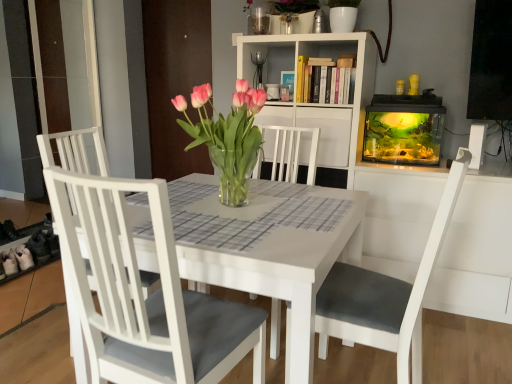
Question: Is pink glass vase at center thinner than white matte chair at left, placed as the 1th chair when sorted from left to right?

Choices:
 (A) no
 (B) yes

Answer: (B)

Question: Does pink glass vase at center lie behind white matte chair at left, placed as the 1th chair when sorted from left to right?

Choices:
 (A) yes
 (B) no

Answer: (B)

Question: From the image's perspective, is pink glass vase at center on top of white matte chair at left, which is the second chair from right to left?

Choices:
 (A) yes
 (B) no

Answer: (A)

Question: From a real-world perspective, is pink glass vase at center over white matte chair at left, placed as the 1th chair when sorted from left to right?

Choices:
 (A) yes
 (B) no

Answer: (A)

Question: Is pink glass vase at center outside white matte chair at left, which is the second chair from right to left?

Choices:
 (A) no
 (B) yes

Answer: (B)

Question: From the image's perspective, relative to pink glass vase at center, is white matte chair at left, which is the second chair from right to left, above or below?

Choices:
 (A) below
 (B) above

Answer: (A)

Question: Is white matte chair at left, which is the second chair from right to left, taller or shorter than pink glass vase at center?

Choices:
 (A) short
 (B) tall

Answer: (B)

Question: Visually, is white matte chair at left, which is the second chair from right to left, positioned to the left or to the right of pink glass vase at center?

Choices:
 (A) right
 (B) left

Answer: (B)

Question: From a real-world perspective, is white matte chair at left, which is the second chair from right to left, above or below pink glass vase at center?

Choices:
 (A) below
 (B) above

Answer: (A)

Question: Do you think white matte chair at left, which is the second chair from right to left, is within white matte chair at center, which appears as the 1th chair when viewed from the right, or outside of it?

Choices:
 (A) inside
 (B) outside

Answer: (B)

Question: Is white matte chair at left, which is the second chair from right to left, bigger or smaller than white matte chair at center, the 2th chair from the left?

Choices:
 (A) small
 (B) big

Answer: (A)

Question: From the image's perspective, is white matte chair at left, which is the second chair from right to left, located above or below white matte chair at center, the 2th chair from the left?

Choices:
 (A) above
 (B) below

Answer: (A)

Question: Considering the positions of white matte chair at left, which is the second chair from right to left, and white matte chair at center, the 2th chair from the left, in the image, is white matte chair at left, which is the second chair from right to left, taller or shorter than white matte chair at center, the 2th chair from the left,?

Choices:
 (A) tall
 (B) short

Answer: (A)

Question: From the image's perspective, is transparent glass aquarium at right above or below white matte chair at left, placed as the 1th chair when sorted from left to right?

Choices:
 (A) below
 (B) above

Answer: (B)

Question: From a real-world perspective, is transparent glass aquarium at right physically located above or below white matte chair at left, which is the second chair from right to left?

Choices:
 (A) below
 (B) above

Answer: (B)